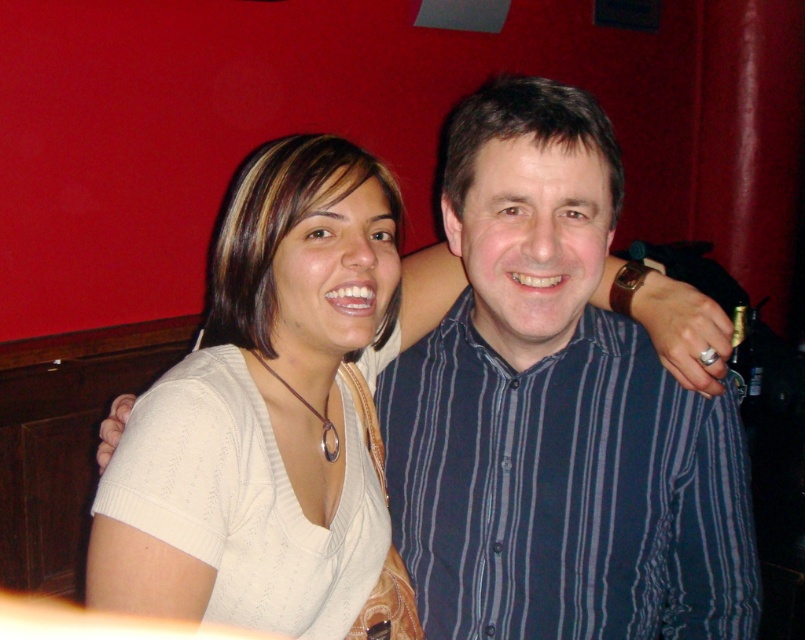
Question: Is white fabric shirt at center above white knitwear at center?

Choices:
 (A) yes
 (B) no

Answer: (B)

Question: Is white fabric shirt at center to the right of white knitwear at center from the viewer's perspective?

Choices:
 (A) yes
 (B) no

Answer: (A)

Question: Estimate the real-world distances between objects in this image. Which object is farther from the blue striped shirt at center?

Choices:
 (A) white fabric shirt at center
 (B) white knitwear at center

Answer: (B)

Question: Which object is the farthest from the blue striped shirt at center?

Choices:
 (A) white fabric shirt at center
 (B) white knitwear at center

Answer: (B)

Question: Which of these objects is positioned closest to the blue striped shirt at center?

Choices:
 (A) white knitwear at center
 (B) white fabric shirt at center

Answer: (B)

Question: Does white fabric shirt at center appear over white knitwear at center?

Choices:
 (A) yes
 (B) no

Answer: (B)